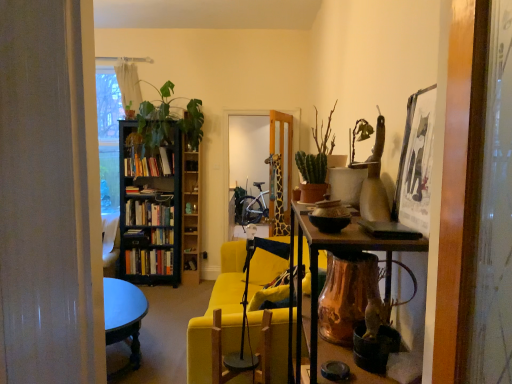
Question: Is green leafy plant at left not inside hardcover books at left, which is the 1th book in top-to-bottom order?

Choices:
 (A) yes
 (B) no

Answer: (A)

Question: From the image's perspective, is green leafy plant at left located above hardcover books at left, which is the 1th book in top-to-bottom order?

Choices:
 (A) no
 (B) yes

Answer: (B)

Question: Can you confirm if green leafy plant at left is wider than hardcover books at left, which is the 1th book in top-to-bottom order?

Choices:
 (A) yes
 (B) no

Answer: (A)

Question: Can you confirm if green leafy plant at left is thinner than hardcover books at left, which is the 1th book in top-to-bottom order?

Choices:
 (A) yes
 (B) no

Answer: (B)

Question: Is green leafy plant at left in front of hardcover books at left, which is the 1th book in top-to-bottom order?

Choices:
 (A) yes
 (B) no

Answer: (A)

Question: Is green leafy plant at left further to camera compared to hardcover books at left, which is the 1th book in top-to-bottom order?

Choices:
 (A) yes
 (B) no

Answer: (B)

Question: Does wooden swivel chair at center have a lesser height compared to green matte cactus at center?

Choices:
 (A) yes
 (B) no

Answer: (A)

Question: Does wooden swivel chair at center have a lesser width compared to green matte cactus at center?

Choices:
 (A) no
 (B) yes

Answer: (B)

Question: Is green matte cactus at center at the back of wooden swivel chair at center?

Choices:
 (A) yes
 (B) no

Answer: (B)

Question: From a real-world perspective, does wooden swivel chair at center stand above green matte cactus at center?

Choices:
 (A) no
 (B) yes

Answer: (A)

Question: Does wooden swivel chair at center have a larger size compared to green matte cactus at center?

Choices:
 (A) yes
 (B) no

Answer: (A)

Question: Is there a large distance between wooden swivel chair at center and green matte cactus at center?

Choices:
 (A) no
 (B) yes

Answer: (A)

Question: Is hardcover books at left, which is counted as the 2th book, starting from the top, facing away from green matte cactus at center?

Choices:
 (A) no
 (B) yes

Answer: (A)